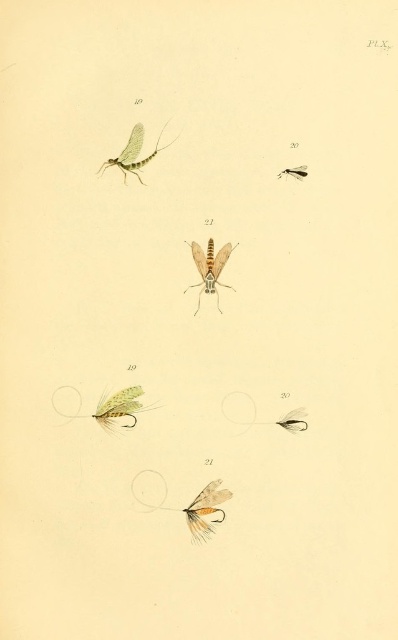
Question: Which of these objects is positioned closest to the translucent yellowish-brown mosquito at center?

Choices:
 (A) translucent yellowish-green fly at upper right
 (B) translucent white feather at bottom center
 (C) translucent yellow fly at center

Answer: (A)

Question: Can you confirm if translucent white feather at bottom center is smaller than translucent yellowish-green fly at upper left?

Choices:
 (A) no
 (B) yes

Answer: (A)

Question: Which object is the closest to the translucent white feather at bottom center?

Choices:
 (A) translucent yellowish-brown mosquito at center
 (B) translucent yellowish-green fly at upper left
 (C) translucent yellowish-green fly at upper right
 (D) translucent yellow fly at center

Answer: (D)

Question: Does translucent yellowish-brown mosquito at center appear under translucent yellowish-green fly at upper left?

Choices:
 (A) no
 (B) yes

Answer: (B)

Question: Is translucent yellowish-brown mosquito at center above translucent yellowish-green fly at upper left?

Choices:
 (A) no
 (B) yes

Answer: (A)

Question: Estimate the real-world distances between objects in this image. Which object is closer to the translucent yellowish-green fly at upper left?

Choices:
 (A) translucent yellowish-brown mosquito at center
 (B) translucent yellow fly at center
 (C) translucent yellowish-green fly at upper right

Answer: (A)